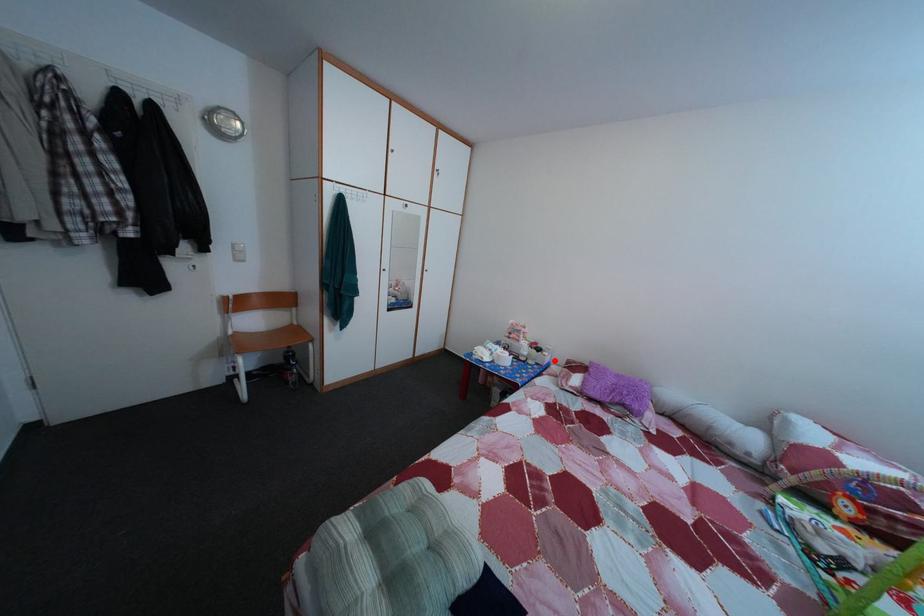
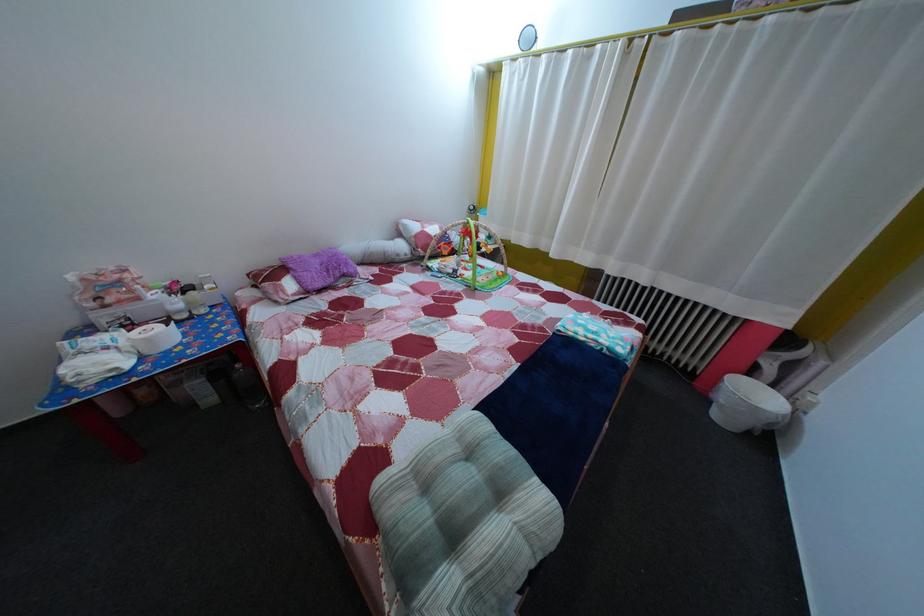
In the second image, find the point that corresponds to the highlighted location in the first image.

(216, 294)